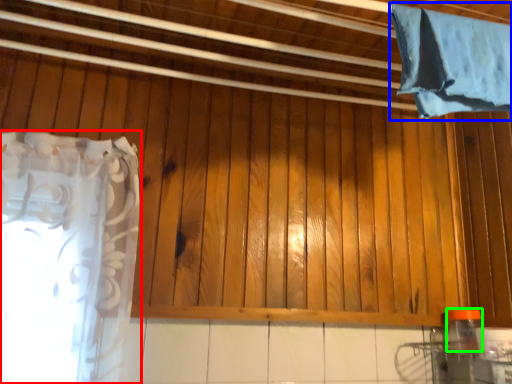
Question: Which object is the farthest from curtain (highlighted by a red box)? Choose among these: curtain (highlighted by a blue box) or bottle (highlighted by a green box).

Choices:
 (A) curtain
 (B) bottle

Answer: (B)